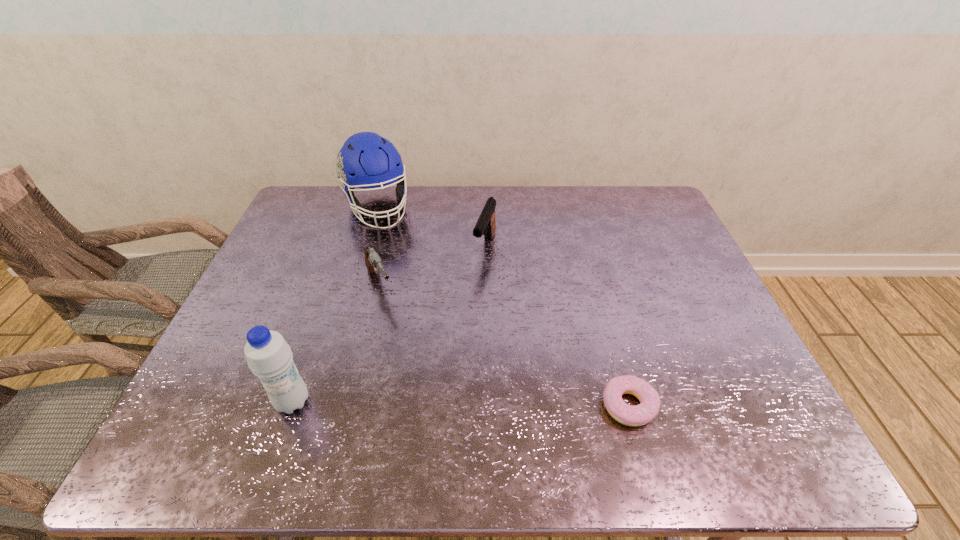
At what (x,y) coordinates should I click in order to perform the action: click on free space located at the barrel of the left pistol. Please return your answer as a coordinate pair (x, y). Looking at the image, I should click on 414,355.

At what (x,y) coordinates should I click in order to perform the action: click on vacant space located at the barrel of the left pistol. Please return your answer as a coordinate pair (x, y). Looking at the image, I should click on (401, 333).

You are a GUI agent. You are given a task and a screenshot of the screen. Output one action in this format:
    pyautogui.click(x=<x>, y=<y>)
    Task: Click on the vacant area situated 0.210m at the barrel of the left pistol
    The width and height of the screenshot is (960, 540).
    Given the screenshot: What is the action you would take?
    pyautogui.click(x=416, y=358)

This screenshot has height=540, width=960. I want to click on vacant space located 0.180m at the barrel of the right pistol, so click(x=465, y=309).

Where is `blank space located 0.170m at the barrel of the right pistol`? blank space located 0.170m at the barrel of the right pistol is located at coordinates (466, 307).

I want to click on vacant space situated at the barrel of the right pistol, so click(476, 282).

This screenshot has height=540, width=960. I want to click on vacant space positioned on the face guard of the football helmet, so click(x=422, y=307).

The image size is (960, 540). In order to click on vacant region located on the face guard of the football helmet in this screenshot , I will do `click(415, 291)`.

I want to click on free space located on the face guard of the football helmet, so click(393, 247).

Identify the location of object that is positioned at the far edge. Image resolution: width=960 pixels, height=540 pixels. (366, 160).